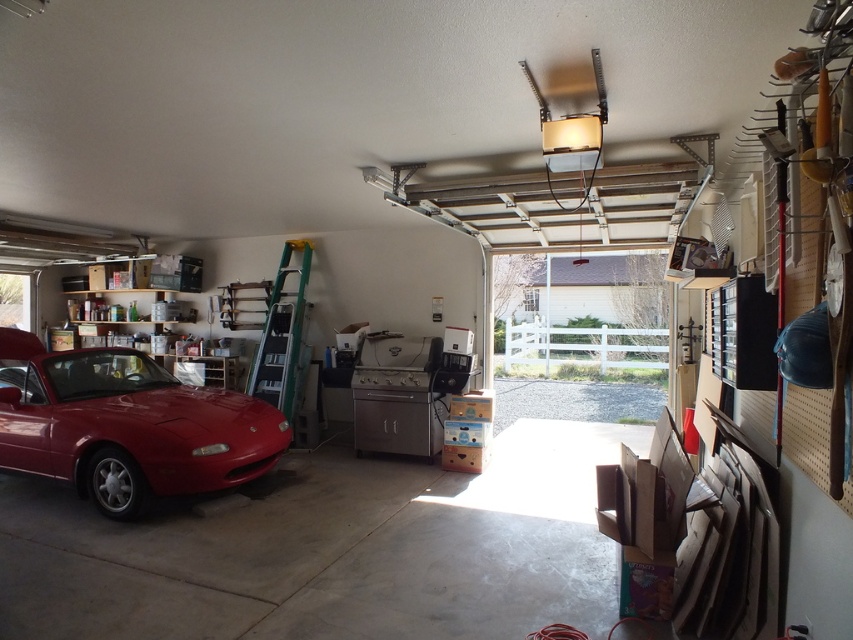
You are trying to move the metallic silver ladder at left to the right side of the garage. Can you move it without touching the glossy red car at left?

The glossy red car at left is wider than the metallic silver ladder at left, so you can move the metallic silver ladder at left to the right side of the garage without touching the glossy red car at left as long as you keep a safe distance.

You are a delivery person who needs to place a large package in the garage. The package is 1.5 meters tall. The glossy red car at left and the metallic silver ladder at left are in your way. Which object is blocking your path more vertically?

The metallic silver ladder at left is higher than the glossy red car at left, so it is blocking the vertical path more.